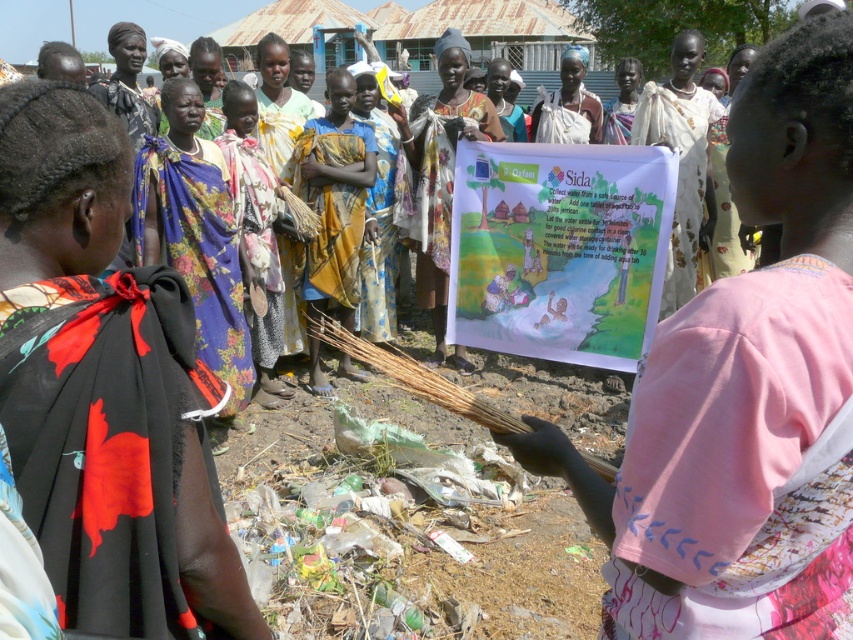
Between pink fabric shirt at center and white woven cloth at center, which one is positioned higher?

white woven cloth at center

Can you confirm if pink fabric shirt at center is thinner than white woven cloth at center?

Yes.

Which is behind, point (782, 461) or point (682, 304)?

Positioned behind is point (682, 304).

In order to click on pink fabric shirt at center in this screenshot , I will do `click(744, 392)`.

Locate an element on the screen. black floral fabric at center is located at coordinates (103, 388).

Is point (207, 406) less distant than point (445, 244)?

That is True.

Locate an element on the screen. This screenshot has height=640, width=853. black floral fabric at center is located at coordinates (103, 388).

What do you see at coordinates (334, 198) in the screenshot? The height and width of the screenshot is (640, 853). I see `yellow woven cloth at center` at bounding box center [334, 198].

Who is lower down, yellow woven cloth at center or printed fabric banner at center?

yellow woven cloth at center is below.

Is point (340, 116) positioned behind point (447, 97)?

No, (340, 116) is in front of (447, 97).

Image resolution: width=853 pixels, height=640 pixels. I want to click on yellow woven cloth at center, so click(x=334, y=198).